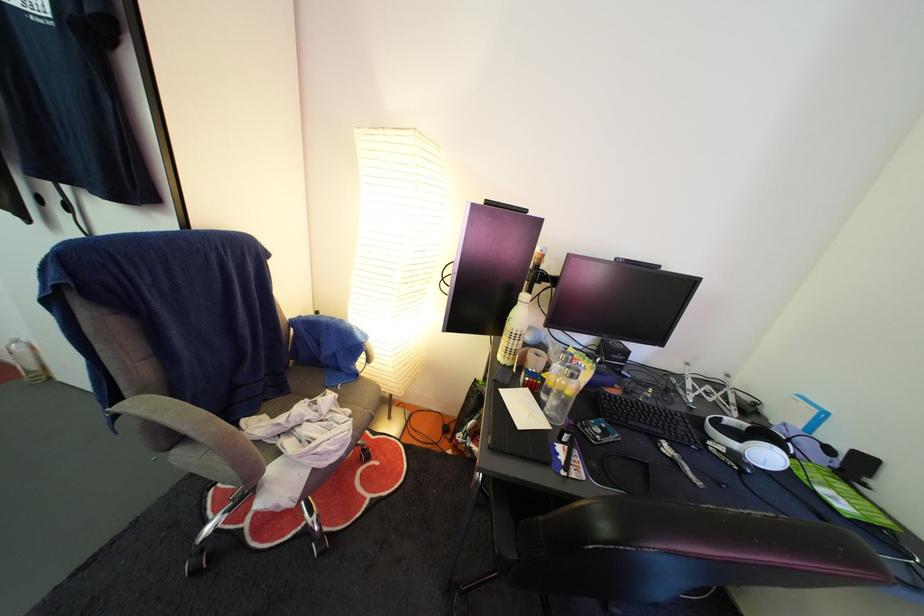
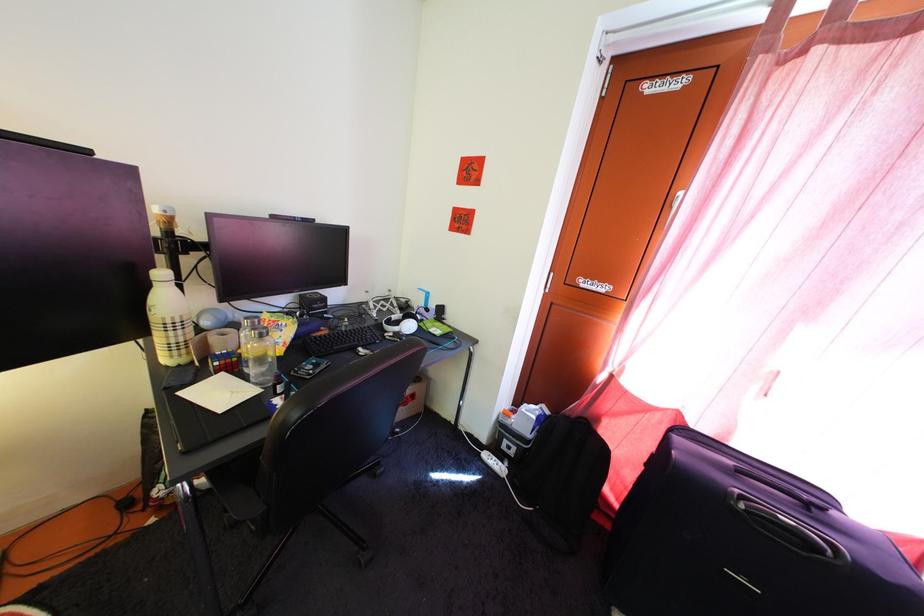
Where in the second image is the point corresponding to point 520,349 from the first image?

(179, 341)